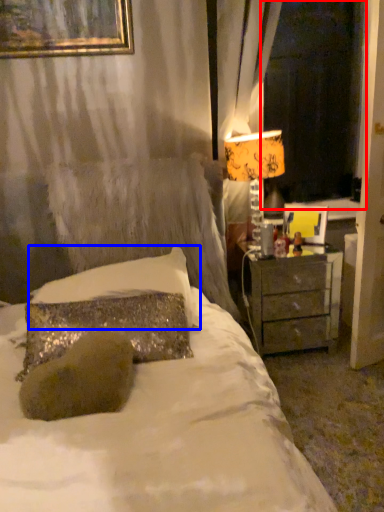
Question: Which point is closer to the camera, window screen (highlighted by a red box) or pillow (highlighted by a blue box)?

Choices:
 (A) window screen
 (B) pillow

Answer: (B)